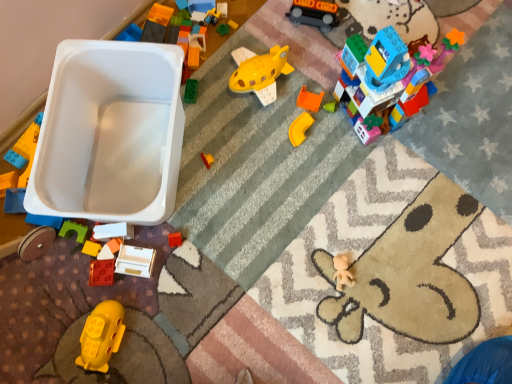
Describe the element at coordinates (395, 64) in the screenshot. The image size is (512, 384). I see `multicolored plastic building block at upper right, which is the eighth toy in left-to-right order` at that location.

Measure the distance between multicolored plastic building block at upper right, which is the eighth toy in left-to-right order, and camera.

They are 33.39 inches apart.

This screenshot has height=384, width=512. What do you see at coordinates (300, 128) in the screenshot? I see `yellow matte plastic corner piece at center-right, acting as the 6th toy starting from the left` at bounding box center [300, 128].

Where is `rubber brick at lower left, marked as the 2th toy in a left-to-right arrangement`? This screenshot has height=384, width=512. rubber brick at lower left, marked as the 2th toy in a left-to-right arrangement is located at coordinates (101, 272).

What is the approximate width of rubberized orange block at lower left, the 1th toy positioned from the left?

rubberized orange block at lower left, the 1th toy positioned from the left, is 1.67 inches wide.

You are a GUI agent. You are given a task and a screenshot of the screen. Output one action in this format:
    pyautogui.click(x=<x>, y=<y>)
    Task: Click on the white matte block at lower left, arranged as the fifth toy when ordered from the bottom
    The width and height of the screenshot is (512, 384).
    Given the screenshot: What is the action you would take?
    pyautogui.click(x=113, y=231)

Locate an element on the screen. The image size is (512, 384). matte white drawer at lower center, which ranks as the third toy in bottom-to-top order is located at coordinates (135, 261).

From the image's perspective, count 7th toys upward from the yellow matte toy submarine at lower left, which is the 3th toy from left to right, and point to it. Please provide its 2D coordinates.

[(314, 13)]

Considering the points (304, 12) and (93, 332), which point is in front, point (304, 12) or point (93, 332)?

Positioned in front is point (93, 332).

Which of these two, shiny black train at upper center, the eighth toy ordered from the bottom, or yellow matte toy submarine at lower left, the 6th toy viewed from the right, stands shorter?

shiny black train at upper center, the eighth toy ordered from the bottom.

Is shiny black train at upper center, arranged as the 1th toy when viewed from the top, in front of or behind yellow matte toy submarine at lower left, which is counted as the eighth toy, starting from the top, in the image?

shiny black train at upper center, arranged as the 1th toy when viewed from the top, is behind yellow matte toy submarine at lower left, which is counted as the eighth toy, starting from the top.

Is white matte block at lower left, the fourth toy from the top, outside of multicolored plastic building block at upper right, the first toy when ordered from right to left?

Yes, white matte block at lower left, the fourth toy from the top, is outside of multicolored plastic building block at upper right, the first toy when ordered from right to left.

Looking at their sizes, would you say white matte block at lower left, which is the fifth toy from right to left, is wider or thinner than multicolored plastic building block at upper right, which appears as the seventh toy when ordered from the bottom?

white matte block at lower left, which is the fifth toy from right to left, is thinner than multicolored plastic building block at upper right, which appears as the seventh toy when ordered from the bottom.

Are white matte block at lower left, arranged as the fifth toy when ordered from the bottom, and multicolored plastic building block at upper right, the 2th toy from the top, beside each other?

white matte block at lower left, arranged as the fifth toy when ordered from the bottom, and multicolored plastic building block at upper right, the 2th toy from the top, are clearly separated.

From a real-world perspective, is white matte block at lower left, arranged as the fifth toy when ordered from the bottom, physically located above or below multicolored plastic building block at upper right, which appears as the seventh toy when ordered from the bottom?

white matte block at lower left, arranged as the fifth toy when ordered from the bottom, is below multicolored plastic building block at upper right, which appears as the seventh toy when ordered from the bottom.

Is multicolored plastic building block at upper right, the first toy when ordered from right to left, taller than yellow matte plastic corner piece at center-right, acting as the 6th toy starting from the left?

Correct, multicolored plastic building block at upper right, the first toy when ordered from right to left, is much taller as yellow matte plastic corner piece at center-right, acting as the 6th toy starting from the left.

Considering their positions, is multicolored plastic building block at upper right, which appears as the seventh toy when ordered from the bottom, located in front of or behind yellow matte plastic corner piece at center-right, acting as the third toy starting from the right?

multicolored plastic building block at upper right, which appears as the seventh toy when ordered from the bottom, is in front of yellow matte plastic corner piece at center-right, acting as the third toy starting from the right.

Considering the sizes of multicolored plastic building block at upper right, the 2th toy from the top, and yellow matte plastic corner piece at center-right, positioned as the third toy in top-to-bottom order, in the image, is multicolored plastic building block at upper right, the 2th toy from the top, wider or thinner than yellow matte plastic corner piece at center-right, positioned as the third toy in top-to-bottom order,?

multicolored plastic building block at upper right, the 2th toy from the top, is wider than yellow matte plastic corner piece at center-right, positioned as the third toy in top-to-bottom order.

From a real-world perspective, is multicolored plastic building block at upper right, the 2th toy from the top, above or below yellow matte plastic corner piece at center-right, acting as the 6th toy starting from the left?

Clearly, from a real-world perspective, multicolored plastic building block at upper right, the 2th toy from the top, is above yellow matte plastic corner piece at center-right, acting as the 6th toy starting from the left.

From the image's perspective, between yellow matte toy submarine at lower left, the 6th toy viewed from the right, and white plastic toy car at upper left, which one is located above?

white plastic toy car at upper left, from the image's perspective.

Is point (115, 310) closer or farther from the camera than point (95, 73)?

Point (115, 310) appears to be closer to the viewer than point (95, 73).

What's the angular difference between yellow matte toy submarine at lower left, which is the first toy from bottom to top, and white plastic toy car at upper left's facing directions?

The facing directions of yellow matte toy submarine at lower left, which is the first toy from bottom to top, and white plastic toy car at upper left are 1.4 degrees apart.

Considering the relative sizes of yellow matte toy submarine at lower left, which is the first toy from bottom to top, and white plastic toy car at upper left in the image provided, is yellow matte toy submarine at lower left, which is the first toy from bottom to top, thinner than white plastic toy car at upper left?

Yes, yellow matte toy submarine at lower left, which is the first toy from bottom to top, is thinner than white plastic toy car at upper left.

Would you say rubberized orange block at lower left, acting as the fifth toy starting from the top, is outside white plastic toy car at upper left?

Indeed, rubberized orange block at lower left, acting as the fifth toy starting from the top, is completely outside white plastic toy car at upper left.

In the scene shown: Is rubberized orange block at lower left, the 1th toy positioned from the left, touching white plastic toy car at upper left?

No, rubberized orange block at lower left, the 1th toy positioned from the left, is not beside white plastic toy car at upper left.

Between rubberized orange block at lower left, acting as the fourth toy starting from the bottom, and white plastic toy car at upper left, which one has more height?

Standing taller between the two is white plastic toy car at upper left.

From the image's perspective, which is below, rubberized orange block at lower left, acting as the fourth toy starting from the bottom, or white plastic toy car at upper left?

rubberized orange block at lower left, acting as the fourth toy starting from the bottom.

In the scene shown: Which of these two, shiny black train at upper center, which ranks as the 2th toy in right-to-left order, or matte white drawer at lower center, which ranks as the third toy in bottom-to-top order, stands taller?

With more height is shiny black train at upper center, which ranks as the 2th toy in right-to-left order.

In the image, is shiny black train at upper center, which ranks as the 2th toy in right-to-left order, on the left side or the right side of matte white drawer at lower center, positioned as the 4th toy in right-to-left order?

shiny black train at upper center, which ranks as the 2th toy in right-to-left order, is to the right of matte white drawer at lower center, positioned as the 4th toy in right-to-left order.

Could you measure the distance between shiny black train at upper center, which ranks as the 2th toy in right-to-left order, and matte white drawer at lower center, which is counted as the 5th toy, starting from the left?

shiny black train at upper center, which ranks as the 2th toy in right-to-left order, and matte white drawer at lower center, which is counted as the 5th toy, starting from the left, are 32.64 inches apart from each other.

Is matte white drawer at lower center, the 6th toy from the top, located within shiny black train at upper center, the 7th toy when ordered from left to right?

No, matte white drawer at lower center, the 6th toy from the top, is not a part of shiny black train at upper center, the 7th toy when ordered from left to right.

Considering the sizes of rubberized orange block at lower left, positioned as the eighth toy in right-to-left order, and matte white drawer at lower center, the 6th toy from the top, in the image, is rubberized orange block at lower left, positioned as the eighth toy in right-to-left order, taller or shorter than matte white drawer at lower center, the 6th toy from the top,?

rubberized orange block at lower left, positioned as the eighth toy in right-to-left order, is shorter than matte white drawer at lower center, the 6th toy from the top.

Could you measure the distance between rubberized orange block at lower left, acting as the fourth toy starting from the bottom, and matte white drawer at lower center, the 6th toy from the top?

They are 3.84 inches apart.

From a real-world perspective, which toy is the 2nd one above the rubberized orange block at lower left, the 1th toy positioned from the left? Please provide its 2D coordinates.

[(135, 261)]

Looking at this image, does rubberized orange block at lower left, the 1th toy positioned from the left, contain matte white drawer at lower center, positioned as the 4th toy in right-to-left order?

No.

Identify the location of the 4th toy counting from the right of the yellow matte toy submarine at lower left, the 6th toy viewed from the right. (314, 13).

From the multicolored plastic building block at upper right, which is the eighth toy in left-to-right order, count 2nd toys backward and point to it. Please provide its 2D coordinates.

[(113, 231)]

Based on their spatial positions, is yellow matte toy submarine at lower left, the 6th toy viewed from the right, or matte white drawer at lower center, positioned as the 4th toy in right-to-left order, further from rubber brick at lower left, the 7th toy positioned from the top?

yellow matte toy submarine at lower left, the 6th toy viewed from the right, is further to rubber brick at lower left, the 7th toy positioned from the top.

From the image, which object appears to be nearer to yellow matte plastic corner piece at center-right, acting as the 6th toy starting from the left, multicolored plastic building block at upper right, which appears as the seventh toy when ordered from the bottom, or rubber brick at lower left, positioned as the seventh toy in right-to-left order?

multicolored plastic building block at upper right, which appears as the seventh toy when ordered from the bottom.

Considering their positions, is matte white drawer at lower center, which is counted as the 5th toy, starting from the left, positioned closer to rubber brick at lower left, the 7th toy positioned from the top, than multicolored plastic building block at upper right, which is the eighth toy in left-to-right order?

matte white drawer at lower center, which is counted as the 5th toy, starting from the left, is closer to rubber brick at lower left, the 7th toy positioned from the top.

Based on their spatial positions, is white matte block at lower left, arranged as the fifth toy when ordered from the bottom, or rubberized orange block at lower left, positioned as the eighth toy in right-to-left order, closer to shiny black train at upper center, the eighth toy ordered from the bottom?

white matte block at lower left, arranged as the fifth toy when ordered from the bottom, is closer to shiny black train at upper center, the eighth toy ordered from the bottom.

When comparing their distances from shiny black train at upper center, the 7th toy when ordered from left to right, does rubberized orange block at lower left, the 1th toy positioned from the left, or yellow matte toy submarine at lower left, which is counted as the eighth toy, starting from the top, seem further?

yellow matte toy submarine at lower left, which is counted as the eighth toy, starting from the top.

Based on their spatial positions, is yellow matte plastic corner piece at center-right, acting as the sixth toy starting from the bottom, or white matte block at lower left, arranged as the fifth toy when ordered from the bottom, further from yellow matte toy submarine at lower left, which is counted as the eighth toy, starting from the top?

yellow matte plastic corner piece at center-right, acting as the sixth toy starting from the bottom.

In the scene shown: From the image, which object appears to be nearer to rubber brick at lower left, positioned as the seventh toy in right-to-left order, multicolored plastic building block at upper right, the first toy when ordered from right to left, or rubberized orange block at lower left, positioned as the eighth toy in right-to-left order?

rubberized orange block at lower left, positioned as the eighth toy in right-to-left order, is positioned closer to the anchor rubber brick at lower left, positioned as the seventh toy in right-to-left order.

Estimate the real-world distances between objects in this image. Which object is closer to shiny black train at upper center, the eighth toy ordered from the bottom, rubberized orange block at lower left, acting as the fifth toy starting from the top, or white plastic toy car at upper left?

The object closer to shiny black train at upper center, the eighth toy ordered from the bottom, is white plastic toy car at upper left.

You are a GUI agent. You are given a task and a screenshot of the screen. Output one action in this format:
    pyautogui.click(x=<x>, y=<y>)
    Task: Click on the toy car between yellow matte plastic corner piece at center-right, acting as the third toy starting from the right, and yellow matte toy submarine at lower left, which is counted as the eighth toy, starting from the top, in the vertical direction
    This screenshot has height=384, width=512.
    Given the screenshot: What is the action you would take?
    pyautogui.click(x=110, y=134)

The image size is (512, 384). Find the location of `toy car between rubberized orange block at lower left, acting as the fourth toy starting from the bottom, and yellow matte plastic corner piece at center-right, acting as the sixth toy starting from the bottom, from left to right`. toy car between rubberized orange block at lower left, acting as the fourth toy starting from the bottom, and yellow matte plastic corner piece at center-right, acting as the sixth toy starting from the bottom, from left to right is located at coordinates 110,134.

Identify the location of toy car between shiny black train at upper center, which ranks as the 2th toy in right-to-left order, and matte white drawer at lower center, the 6th toy from the top, from top to bottom. (110, 134).

The width and height of the screenshot is (512, 384). In order to click on toy located between white matte block at lower left, which ranks as the 4th toy in left-to-right order, and yellow matte plastic corner piece at center-right, acting as the third toy starting from the right, in the left-right direction in this screenshot , I will do `click(135, 261)`.